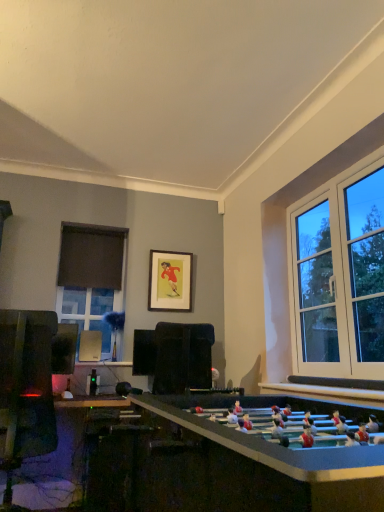
Question: Can you confirm if matte glass window at left is positioned to the right of black fabric curtain at left?

Choices:
 (A) yes
 (B) no

Answer: (B)

Question: Is matte glass window at left further to the viewer compared to black fabric curtain at left?

Choices:
 (A) no
 (B) yes

Answer: (A)

Question: From a real-world perspective, is matte glass window at left located higher than black fabric curtain at left?

Choices:
 (A) yes
 (B) no

Answer: (B)

Question: From a real-world perspective, is matte glass window at left physically below black fabric curtain at left?

Choices:
 (A) no
 (B) yes

Answer: (B)

Question: From the image's perspective, is matte glass window at left above black fabric curtain at left?

Choices:
 (A) no
 (B) yes

Answer: (A)

Question: Based on their positions, is matte glass window at left located to the left or right of wooden framed picture at center?

Choices:
 (A) left
 (B) right

Answer: (A)

Question: Is matte glass window at left bigger or smaller than wooden framed picture at center?

Choices:
 (A) big
 (B) small

Answer: (A)

Question: In terms of height, does matte glass window at left look taller or shorter compared to wooden framed picture at center?

Choices:
 (A) short
 (B) tall

Answer: (B)

Question: From a real-world perspective, is matte glass window at left above or below wooden framed picture at center?

Choices:
 (A) below
 (B) above

Answer: (A)

Question: From the image's perspective, is matte glass window at left positioned above or below black fabric curtain at left?

Choices:
 (A) above
 (B) below

Answer: (B)

Question: Is matte glass window at left wider or thinner than black fabric curtain at left?

Choices:
 (A) thin
 (B) wide

Answer: (B)

Question: In the image, is matte glass window at left positioned in front of or behind black fabric curtain at left?

Choices:
 (A) front
 (B) behind

Answer: (A)

Question: Is point (109, 289) positioned closer to the camera than point (72, 245)?

Choices:
 (A) farther
 (B) closer

Answer: (A)

Question: Is point (178, 260) positioned closer to the camera than point (96, 264)?

Choices:
 (A) closer
 (B) farther

Answer: (B)

Question: From the image's perspective, is wooden framed picture at center located above or below black fabric curtain at left?

Choices:
 (A) above
 (B) below

Answer: (B)